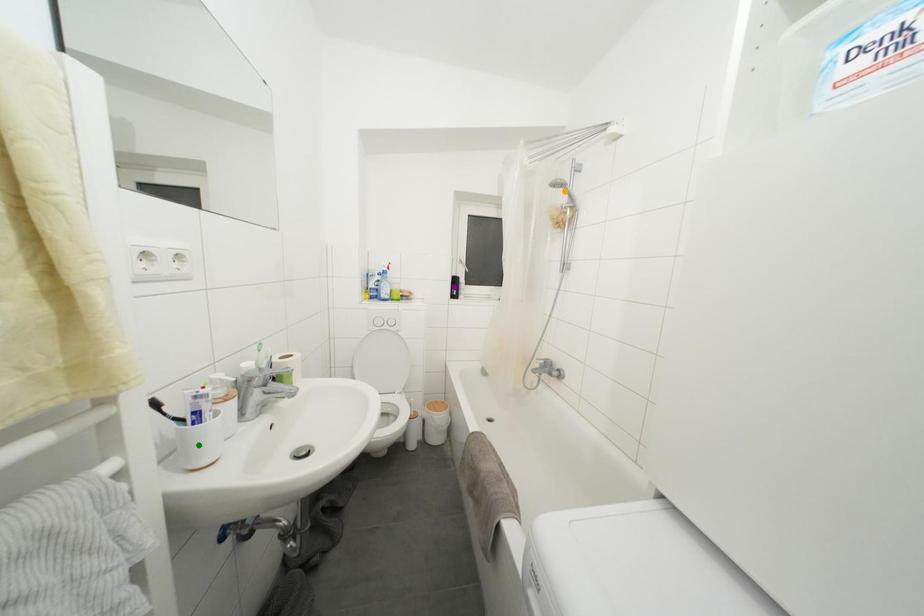
Order these from nearest to farthest:
- green point
- purple point
- orange point

1. green point
2. orange point
3. purple point